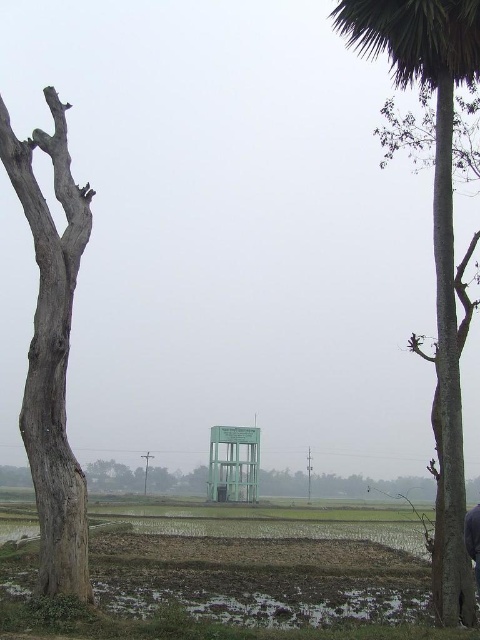
Question: Which of the following is the farthest from the observer?

Choices:
 (A) (214, 618)
 (B) (443, 195)

Answer: (A)

Question: Does gray rough bark tree at left have a greater width compared to muddy wet field at lower center?

Choices:
 (A) yes
 (B) no

Answer: (B)

Question: Which object appears farthest from the camera in this image?

Choices:
 (A) green leafy palm tree at right
 (B) gray rough bark tree at left
 (C) muddy wet field at lower center

Answer: (C)

Question: Among these objects, which one is farthest from the camera?

Choices:
 (A) gray rough bark tree at left
 (B) green leafy palm tree at right
 (C) muddy wet field at lower center

Answer: (C)

Question: Does green leafy palm tree at right appear under gray rough bark tree at left?

Choices:
 (A) yes
 (B) no

Answer: (B)

Question: Is green leafy palm tree at right closer to the viewer compared to gray rough bark tree at left?

Choices:
 (A) no
 (B) yes

Answer: (A)